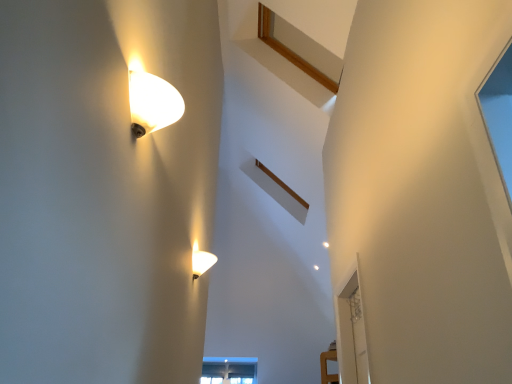
Question: From a real-world perspective, is matte white lamp at lower center, acting as the first lamp starting from the bottom, under transparent glass door at right?

Choices:
 (A) no
 (B) yes

Answer: (A)

Question: Is matte white lamp at lower center, the second lamp from the front, at the left side of transparent glass door at right?

Choices:
 (A) yes
 (B) no

Answer: (A)

Question: Considering the relative positions of matte white lamp at lower center, placed as the 1th lamp when sorted from back to front, and transparent glass door at right in the image provided, is matte white lamp at lower center, placed as the 1th lamp when sorted from back to front, in front of transparent glass door at right?

Choices:
 (A) yes
 (B) no

Answer: (A)

Question: Is matte white lamp at lower center, which is counted as the 2th lamp, starting from the top, not close to transparent glass door at right?

Choices:
 (A) no
 (B) yes

Answer: (B)

Question: Does matte white lamp at lower center, the second lamp from the front, have a lesser width compared to transparent glass door at right?

Choices:
 (A) yes
 (B) no

Answer: (B)

Question: From a real-world perspective, is matte glass lamp at upper left, which is the 1th lamp in front-to-back order, above or below transparent glass door at right?

Choices:
 (A) below
 (B) above

Answer: (B)

Question: Would you say matte glass lamp at upper left, which is the 1th lamp in front-to-back order, is to the left or to the right of transparent glass door at right in the picture?

Choices:
 (A) right
 (B) left

Answer: (B)

Question: Considering the positions of point (143, 92) and point (335, 301), is point (143, 92) closer or farther from the camera than point (335, 301)?

Choices:
 (A) closer
 (B) farther

Answer: (A)

Question: Is matte glass lamp at upper left, marked as the 1th lamp in a top-to-bottom arrangement, bigger or smaller than transparent glass door at right?

Choices:
 (A) small
 (B) big

Answer: (A)

Question: Considering the positions of matte white lamp at lower center, which is counted as the 2th lamp, starting from the top, and transparent glass door at right in the image, is matte white lamp at lower center, which is counted as the 2th lamp, starting from the top, taller or shorter than transparent glass door at right?

Choices:
 (A) tall
 (B) short

Answer: (B)

Question: Is matte white lamp at lower center, which is counted as the 2th lamp, starting from the top, wider or thinner than transparent glass door at right?

Choices:
 (A) thin
 (B) wide

Answer: (B)

Question: In the image, is matte white lamp at lower center, which is counted as the 2th lamp, starting from the top, positioned in front of or behind transparent glass door at right?

Choices:
 (A) front
 (B) behind

Answer: (A)

Question: Visually, is matte white lamp at lower center, placed as the 1th lamp when sorted from back to front, positioned to the left or to the right of transparent glass door at right?

Choices:
 (A) left
 (B) right

Answer: (A)

Question: Which is correct: matte white lamp at lower center, acting as the first lamp starting from the bottom, is inside matte glass lamp at upper left, marked as the 1th lamp in a top-to-bottom arrangement, or outside of it?

Choices:
 (A) inside
 (B) outside

Answer: (B)

Question: Based on their sizes in the image, would you say matte white lamp at lower center, acting as the first lamp starting from the bottom, is bigger or smaller than matte glass lamp at upper left, the second lamp positioned from the back?

Choices:
 (A) small
 (B) big

Answer: (A)